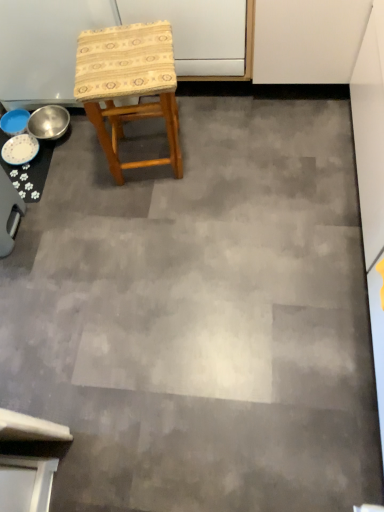
Where is `vacant space in metallic silver bowl at left (from a real-world perspective)`? This screenshot has height=512, width=384. vacant space in metallic silver bowl at left (from a real-world perspective) is located at coordinates (68, 133).